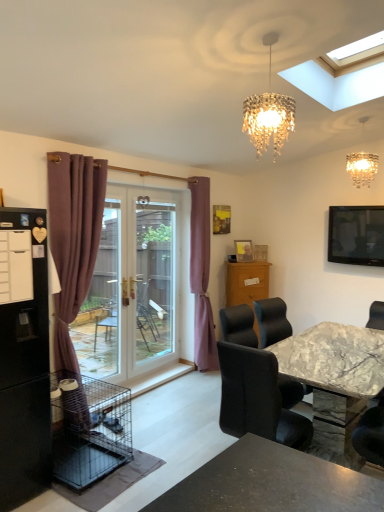
Question: Is transparent glass screen door at center taller or shorter than flat screen tv at upper right?

Choices:
 (A) short
 (B) tall

Answer: (B)

Question: In the image, is transparent glass screen door at center on the left side or the right side of flat screen tv at upper right?

Choices:
 (A) left
 (B) right

Answer: (A)

Question: Estimate the real-world distances between objects in this image. Which object is farther from the flat screen tv at upper right?

Choices:
 (A) mauve fabric curtain at center, placed as the 1th curtain when sorted from right to left
 (B) mauve velvet curtain at left, which is the 1th curtain in left-to-right order
 (C) black matte refrigerator at left
 (D) wooden picture frame at center
 (E) crystal glass chandelier at upper center

Answer: (C)

Question: Based on their relative distances, which object is farther from the crystal glass chandelier at upper center?

Choices:
 (A) flat screen tv at upper right
 (B) black matte refrigerator at left
 (C) marble table at center
 (D) mauve fabric curtain at center, positioned as the second curtain in front-to-back order
 (E) marble-textured chair at lower right

Answer: (B)